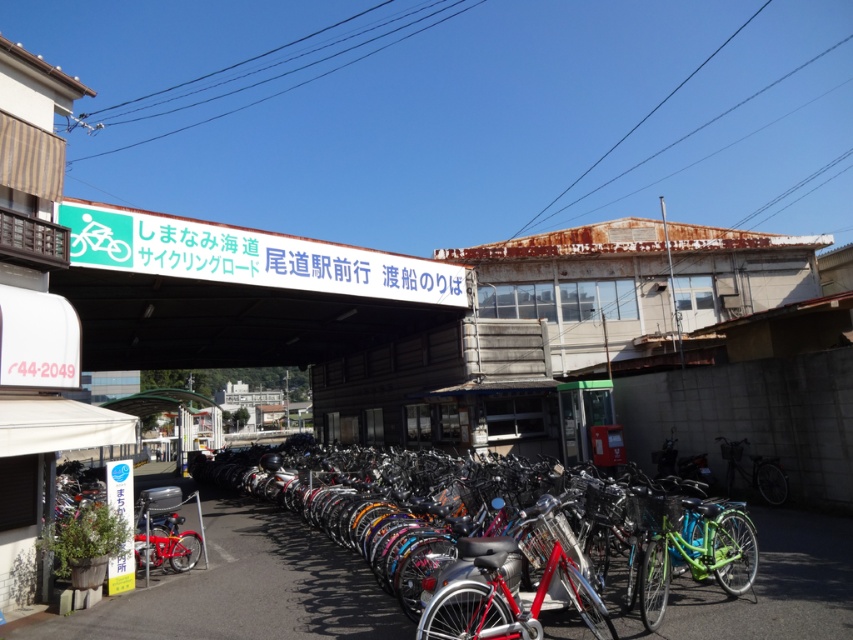
You are a cyclist who wants to park your bicycle in the parking area shown. You have two options to choose from the scene, the shiny red bicycle at center and the green matte bicycle at center. Which bicycle is positioned lower in the image?

The shiny red bicycle at center is positioned lower than the green matte bicycle at center in the image.

Looking at this image, you are a delivery person who needs to attach a package to your bicycle. The green signboard at upper center has instructions for parking. Can you reach the signboard from your current position near the green matte bicycle at center without moving the bicycle more than 10 feet?

The green signboard at upper center and green matte bicycle at center are 13.27 feet apart from each other. Since 13.27 feet exceeds the 10 feet limit, you cannot reach the signboard without moving the bicycle more than 10 feet.

You are a cyclist who just arrived at the station and need to park your bike. You see the green signboard at upper center and the shiny metallic bicycle at center. According to the parking rules displayed on the signboard, which direction should you look to find the designated parking area for your bicycle?

The green signboard at upper center is to the left of the shiny metallic bicycle at center, so you should look to the left of the shiny metallic bicycle at center to find the designated parking area as indicated by the signboard.